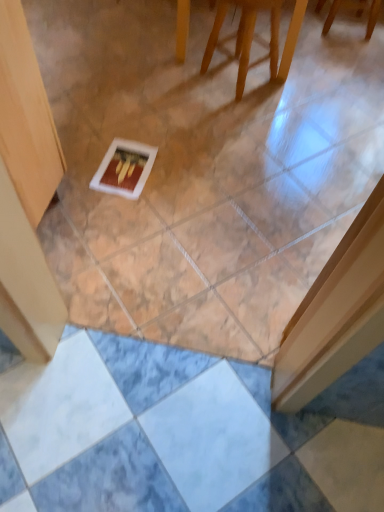
Question: Is wooden chair at upper center, the first furniture viewed from the back, oriented towards wooden chair at upper center, the second furniture from the right?

Choices:
 (A) no
 (B) yes

Answer: (A)

Question: Does wooden chair at upper center, which is counted as the second furniture, starting from the front, lie behind wooden chair at upper center, which is the 1th furniture from bottom to top?

Choices:
 (A) no
 (B) yes

Answer: (B)

Question: From the image's perspective, is wooden chair at upper center, the first furniture in the right-to-left sequence, above wooden chair at upper center, which ranks as the first furniture in left-to-right order?

Choices:
 (A) no
 (B) yes

Answer: (B)

Question: Considering the relative sizes of wooden chair at upper center, the second furniture ordered from the bottom, and wooden chair at upper center, marked as the 2th furniture in a back-to-front arrangement, in the image provided, is wooden chair at upper center, the second furniture ordered from the bottom, wider than wooden chair at upper center, marked as the 2th furniture in a back-to-front arrangement,?

Choices:
 (A) no
 (B) yes

Answer: (B)

Question: Is wooden chair at upper center, the first furniture in the right-to-left sequence, positioned with its back to wooden chair at upper center, which is the 1th furniture from bottom to top?

Choices:
 (A) yes
 (B) no

Answer: (B)

Question: Considering the relative positions of wooden chair at upper center, the first furniture viewed from the back, and wooden chair at upper center, which is the 1th furniture from bottom to top, in the image provided, is wooden chair at upper center, the first furniture viewed from the back, to the left of wooden chair at upper center, which is the 1th furniture from bottom to top, from the viewer's perspective?

Choices:
 (A) yes
 (B) no

Answer: (B)

Question: Is white matte postcard at center further to the viewer compared to wooden chair at upper center, which appears as the 2th furniture when viewed from the left?

Choices:
 (A) yes
 (B) no

Answer: (B)

Question: Considering the relative sizes of white matte postcard at center and wooden chair at upper center, the second furniture ordered from the bottom, in the image provided, is white matte postcard at center shorter than wooden chair at upper center, the second furniture ordered from the bottom,?

Choices:
 (A) yes
 (B) no

Answer: (A)

Question: From the image's perspective, is white matte postcard at center over wooden chair at upper center, which appears as the 2th furniture when viewed from the left?

Choices:
 (A) yes
 (B) no

Answer: (B)

Question: Is white matte postcard at center completely or partially outside of wooden chair at upper center, which appears as the 2th furniture when viewed from the left?

Choices:
 (A) yes
 (B) no

Answer: (A)

Question: From a real-world perspective, is white matte postcard at center located beneath wooden chair at upper center, the second furniture ordered from the bottom?

Choices:
 (A) no
 (B) yes

Answer: (B)

Question: Is white matte postcard at center bigger than wooden chair at upper center, the second furniture ordered from the bottom?

Choices:
 (A) yes
 (B) no

Answer: (B)

Question: Is white matte postcard at center shorter than wooden chair at upper center, the first furniture from the front?

Choices:
 (A) yes
 (B) no

Answer: (A)